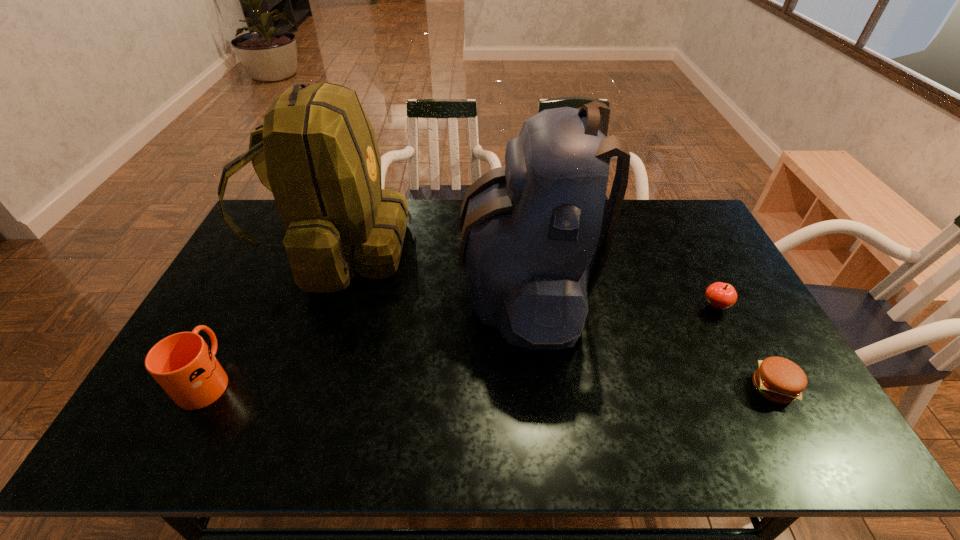
Find the location of a particular element. Image resolution: width=960 pixels, height=540 pixels. free space located on the handle side of the third shortest object is located at coordinates click(250, 298).

At what (x,y) coordinates should I click in order to perform the action: click on blank area located 0.200m on the handle side of the third shortest object. Please return your answer as a coordinate pair (x, y). Looking at the image, I should click on (250, 298).

At what (x,y) coordinates should I click in order to perform the action: click on vacant space located 0.100m on the front of the apple. Please return your answer as a coordinate pair (x, y). Looking at the image, I should click on (735, 343).

At what (x,y) coordinates should I click in order to perform the action: click on free region located 0.320m on the left of the hamburger. Please return your answer as a coordinate pair (x, y). This screenshot has height=540, width=960. Looking at the image, I should click on (624, 388).

The image size is (960, 540). I want to click on backpack that is at the left edge, so point(316,151).

Find the location of `mug that is at the left edge`. mug that is at the left edge is located at coordinates tap(183, 365).

What are the coordinates of `apple that is at the right edge` in the screenshot? It's located at (719, 295).

At what (x,y) coordinates should I click in order to perform the action: click on hamburger present at the right edge. Please return your answer as a coordinate pair (x, y). Image resolution: width=960 pixels, height=540 pixels. Looking at the image, I should click on (778, 379).

Where is `object located at the far left corner`? The height and width of the screenshot is (540, 960). object located at the far left corner is located at coordinates (316, 151).

Identify the location of vacant area at the far edge. The image size is (960, 540). (443, 239).